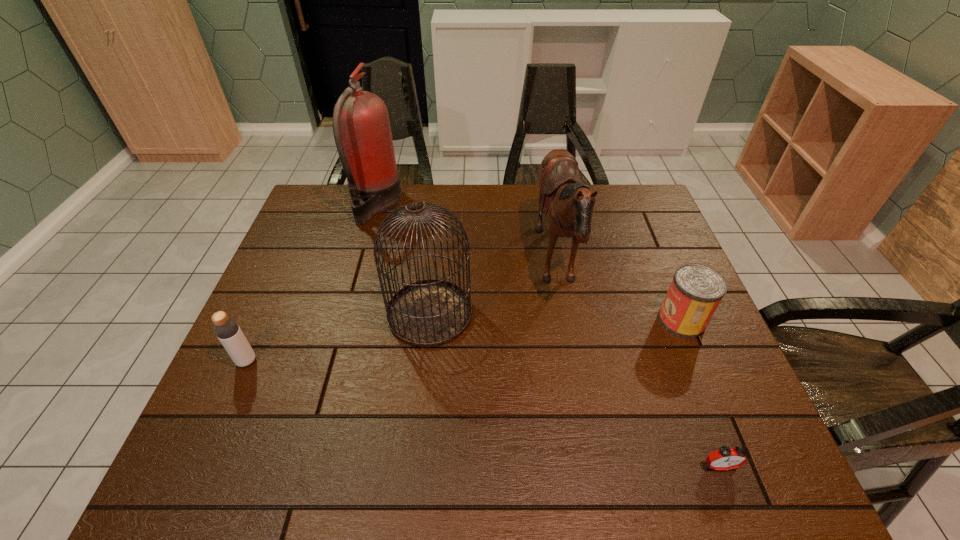
You are a GUI agent. You are given a task and a screenshot of the screen. Output one action in this format:
    pyautogui.click(x=<x>, y=<y>)
    Task: Click on the fire extinguisher
    
    Given the screenshot: What is the action you would take?
    pyautogui.click(x=361, y=127)

Identify the location of saddle. (568, 203).

Where is `the fourth object from right to left`? The image size is (960, 540). the fourth object from right to left is located at coordinates (427, 313).

Identify the location of bottle. (227, 330).

Find the location of a particular element. the leftmost object is located at coordinates (227, 330).

Identify the location of can. The width and height of the screenshot is (960, 540). (696, 290).

The image size is (960, 540). I want to click on the nearest object, so click(725, 458).

The width and height of the screenshot is (960, 540). I want to click on alarm clock, so click(725, 458).

Identify the location of free region located at the nozzle of the fifth object from right to left. (521, 205).

I want to click on vacant area located on the back of the saddle, so click(x=511, y=266).